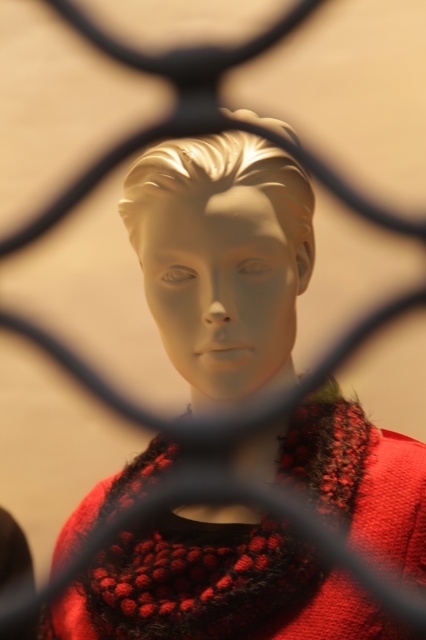
Who is taller, matte white head at center or knitted wool scarf at center?

With more height is matte white head at center.

Between point (155, 320) and point (135, 493), which one is positioned behind?

The point (135, 493) is more distant.

Where is `matte white head at center`? matte white head at center is located at coordinates (221, 257).